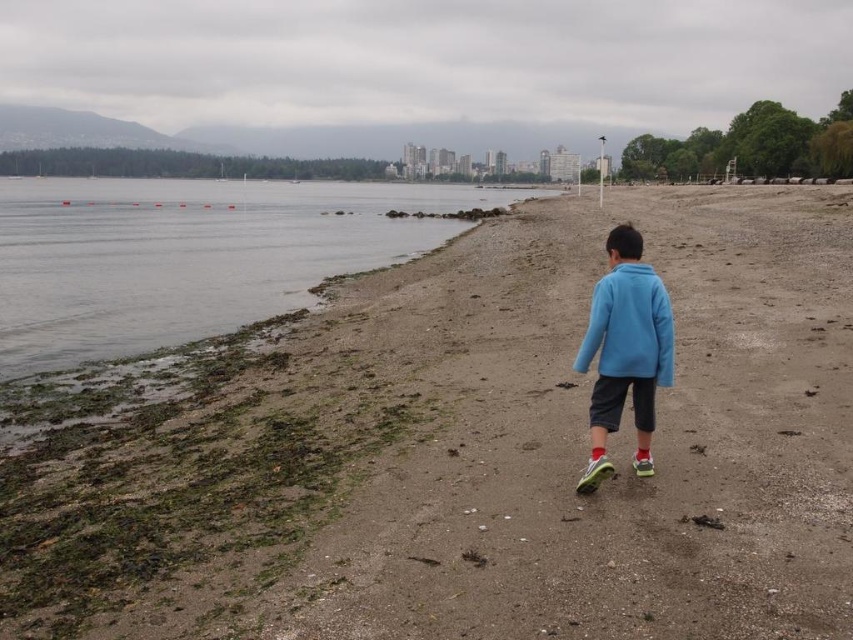
Which is behind, point (851, 502) or point (10, 180)?

Positioned behind is point (10, 180).

Can you confirm if dull sand beach at center is positioned above smooth sand at lower left?

No.

Between point (529, 244) and point (4, 340), which one is positioned behind?

The point (529, 244) is behind.

The width and height of the screenshot is (853, 640). What are the coordinates of `dull sand beach at center` in the screenshot? It's located at (463, 451).

Is dull sand beach at center above blue fleece jacket at center?

Yes.

Who is lower down, dull sand beach at center or blue fleece jacket at center?

blue fleece jacket at center is lower down.

Is point (288, 534) in front of point (633, 227)?

Yes.

The width and height of the screenshot is (853, 640). I want to click on dull sand beach at center, so point(463,451).

Is blue fleece jacket at center to the right of matte blue jacket at center from the viewer's perspective?

No, blue fleece jacket at center is not to the right of matte blue jacket at center.

Is blue fleece jacket at center above matte blue jacket at center?

Yes.

Is point (583, 484) closer to viewer compared to point (619, 284)?

Yes, point (583, 484) is in front of point (619, 284).

The image size is (853, 640). In order to click on blue fleece jacket at center in this screenshot , I will do `click(625, 352)`.